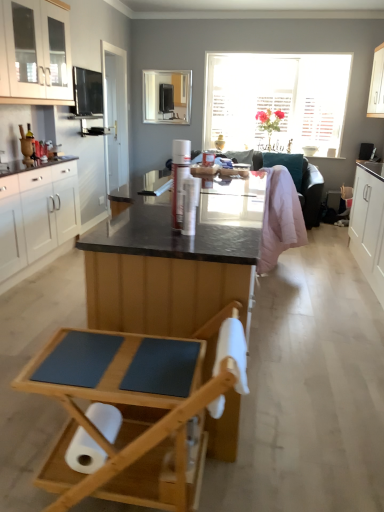
Question: From the image's perspective, would you say white glossy cabinets at upper left, positioned as the second cabinetry in left-to-right order, is shown under white glossy door at center?

Choices:
 (A) no
 (B) yes

Answer: (B)

Question: Could you tell me if white glossy cabinets at upper left, positioned as the second cabinetry in left-to-right order, is turned towards white glossy door at center?

Choices:
 (A) yes
 (B) no

Answer: (B)

Question: Are white glossy cabinets at upper left, positioned as the second cabinetry in left-to-right order, and white glossy door at center located far from each other?

Choices:
 (A) no
 (B) yes

Answer: (B)

Question: Is white glossy cabinets at upper left, which ranks as the third cabinetry in right-to-left order, positioned beyond the bounds of white glossy door at center?

Choices:
 (A) yes
 (B) no

Answer: (A)

Question: From the image's perspective, does white glossy cabinets at upper left, which ranks as the third cabinetry in right-to-left order, appear higher than white glossy door at center?

Choices:
 (A) yes
 (B) no

Answer: (B)

Question: From a real-world perspective, is white glossy cabinets at upper left, which ranks as the third cabinetry in right-to-left order, physically located above or below wooden folding chair at lower center?

Choices:
 (A) above
 (B) below

Answer: (A)

Question: Is white glossy cabinets at upper left, positioned as the second cabinetry in left-to-right order, wider or thinner than wooden folding chair at lower center?

Choices:
 (A) wide
 (B) thin

Answer: (B)

Question: Is point (51, 41) positioned closer to the camera than point (192, 376)?

Choices:
 (A) farther
 (B) closer

Answer: (A)

Question: In terms of size, does white glossy cabinets at upper left, which ranks as the third cabinetry in right-to-left order, appear bigger or smaller than wooden folding chair at lower center?

Choices:
 (A) small
 (B) big

Answer: (B)

Question: In the image, is teal fabric couch at center positioned in front of or behind wooden folding chair at lower center?

Choices:
 (A) behind
 (B) front

Answer: (A)

Question: Choose the correct answer: Is teal fabric couch at center inside wooden folding chair at lower center or outside it?

Choices:
 (A) outside
 (B) inside

Answer: (A)

Question: Based on their positions, is teal fabric couch at center located to the left or right of wooden folding chair at lower center?

Choices:
 (A) right
 (B) left

Answer: (A)

Question: Based on their sizes in the image, would you say teal fabric couch at center is bigger or smaller than wooden folding chair at lower center?

Choices:
 (A) big
 (B) small

Answer: (A)

Question: From the image's perspective, is white glossy door at center above or below pink quilted blanket at center?

Choices:
 (A) below
 (B) above

Answer: (B)

Question: In terms of width, does white glossy door at center look wider or thinner when compared to pink quilted blanket at center?

Choices:
 (A) thin
 (B) wide

Answer: (A)